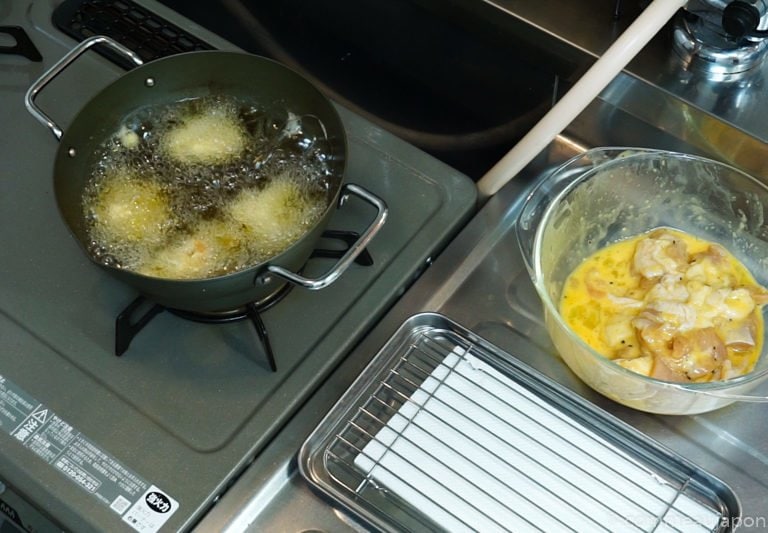
In order to click on boiling water inside black pot in this screenshot , I will do `click(219, 175)`.